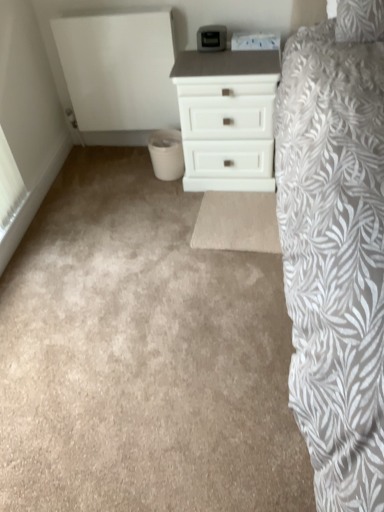
Locate an element on the screen. free location to the left of white matte chest of drawers at center is located at coordinates (128, 184).